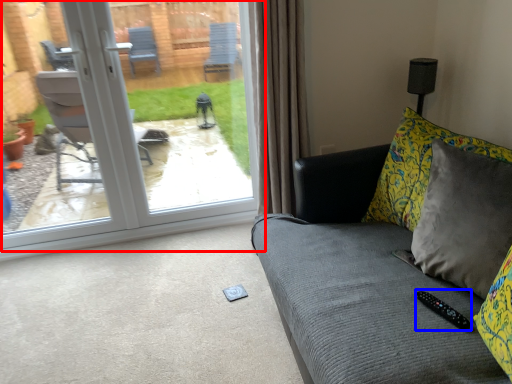
Question: Which object is further to the camera taking this photo, door (highlighted by a red box) or remote (highlighted by a blue box)?

Choices:
 (A) door
 (B) remote

Answer: (A)